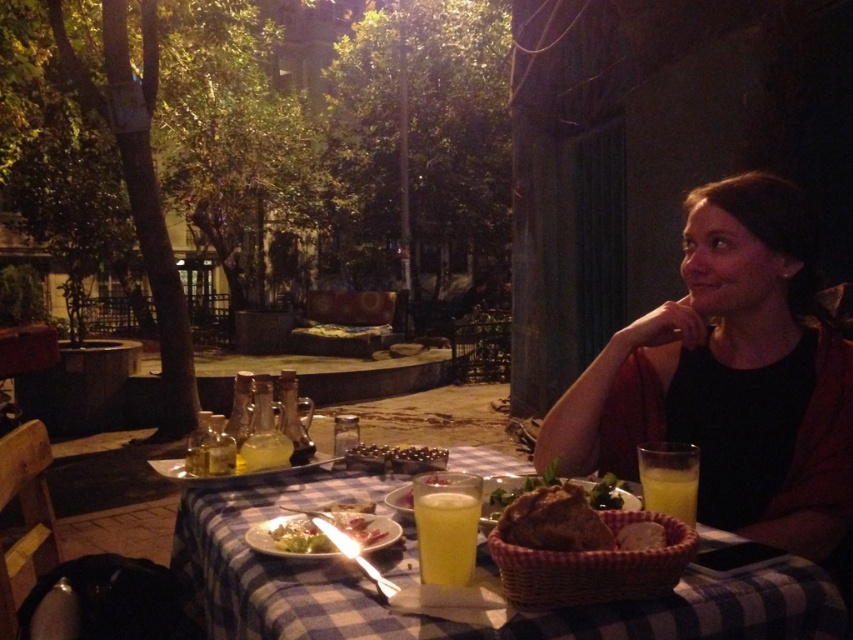
Question: Is yellow translucent glass at table center wider than matte white plate with salad at center?

Choices:
 (A) yes
 (B) no

Answer: (B)

Question: Among these points, which one is farthest from the camera?

Choices:
 (A) (466, 506)
 (B) (643, 534)
 (C) (445, 460)

Answer: (C)

Question: Which point is closer to the camera taking this photo?

Choices:
 (A) (189, 564)
 (B) (636, 536)
 (C) (817, 316)
 (D) (354, 524)

Answer: (B)

Question: Can you confirm if yellow translucent glass at table center is positioned to the right of yellow translucent glass at right?

Choices:
 (A) yes
 (B) no

Answer: (B)

Question: Which object appears farthest from the camera in this image?

Choices:
 (A) matte white plate with salad at center
 (B) yellow translucent glass at table center
 (C) black matte shirt at center

Answer: (C)

Question: Is plastic basket at center bigger than matte white plate with salad at center?

Choices:
 (A) yes
 (B) no

Answer: (A)